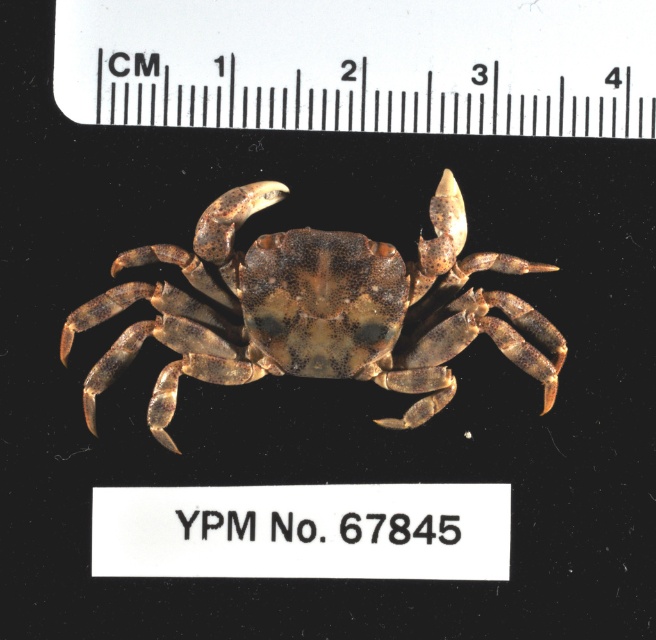
Question: Where is white plastic ruler at upper center located in relation to brown textured crab at center in the image?

Choices:
 (A) above
 (B) below

Answer: (A)

Question: Does white plastic ruler at upper center appear on the left side of brown textured crab at center?

Choices:
 (A) no
 (B) yes

Answer: (A)

Question: Is white plastic ruler at upper center above brown textured crab at center?

Choices:
 (A) no
 (B) yes

Answer: (B)

Question: Among these points, which one is farthest from the camera?

Choices:
 (A) (584, 58)
 (B) (180, 321)

Answer: (B)